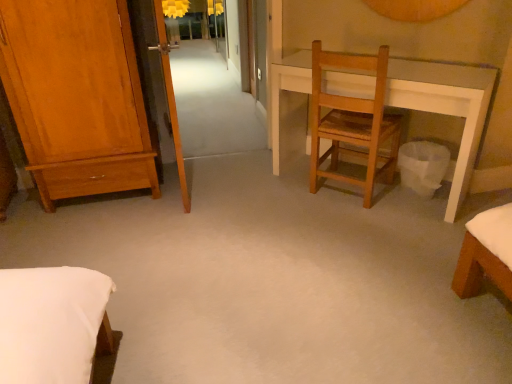
This screenshot has width=512, height=384. Find the location of `free spot below wooden chair at center (from a real-world perspective)`. free spot below wooden chair at center (from a real-world perspective) is located at coordinates (342, 194).